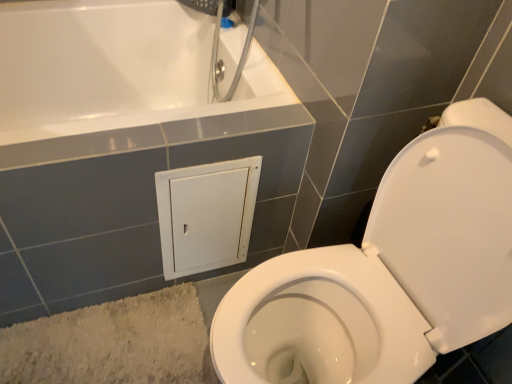
Describe the element at coordinates (113, 343) in the screenshot. The width and height of the screenshot is (512, 384). I see `beige textured bath mat at lower left` at that location.

Measure the distance between beige textured bath mat at lower left and camera.

The distance of beige textured bath mat at lower left from camera is 1.08 meters.

In order to click on beige textured bath mat at lower left in this screenshot , I will do `click(113, 343)`.

Find the location of a particular element. This screenshot has height=384, width=512. white glossy toilet at lower right is located at coordinates (395, 265).

This screenshot has width=512, height=384. Describe the element at coordinates (395, 265) in the screenshot. I see `white glossy toilet at lower right` at that location.

In order to click on beige textured bath mat at lower left in this screenshot , I will do `click(113, 343)`.

From the picture: In the image, is beige textured bath mat at lower left on the left side or the right side of white glossy toilet at lower right?

In the image, beige textured bath mat at lower left appears on the left side of white glossy toilet at lower right.

Consider the image. Which is in front, beige textured bath mat at lower left or white glossy toilet at lower right?

white glossy toilet at lower right is in front.

Considering the points (76, 334) and (475, 234), which point is behind, point (76, 334) or point (475, 234)?

The point (76, 334) is more distant.

From the image's perspective, which one is positioned higher, beige textured bath mat at lower left or white glossy toilet at lower right?

white glossy toilet at lower right, from the image's perspective.

From the picture: From a real-world perspective, between beige textured bath mat at lower left and white glossy toilet at lower right, who is vertically higher?

From a 3D spatial view, white glossy toilet at lower right is above.

Considering the sizes of objects beige textured bath mat at lower left and white glossy toilet at lower right in the image provided, who is thinner, beige textured bath mat at lower left or white glossy toilet at lower right?

beige textured bath mat at lower left.

Consider the image. Considering the sizes of objects beige textured bath mat at lower left and white glossy toilet at lower right in the image provided, who is shorter, beige textured bath mat at lower left or white glossy toilet at lower right?

beige textured bath mat at lower left.

In terms of size, does beige textured bath mat at lower left appear bigger or smaller than white glossy toilet at lower right?

In the image, beige textured bath mat at lower left appears to be smaller than white glossy toilet at lower right.

Is beige textured bath mat at lower left not within white glossy toilet at lower right?

Yes, beige textured bath mat at lower left is outside of white glossy toilet at lower right.

Is beige textured bath mat at lower left far from white glossy toilet at lower right?

No, there isn't a large distance between beige textured bath mat at lower left and white glossy toilet at lower right.

Is beige textured bath mat at lower left oriented away from white glossy toilet at lower right?

No.

How different are the orientations of beige textured bath mat at lower left and white glossy toilet at lower right in degrees?

94.5 degrees.

Locate an element on the screen. Image resolution: width=512 pixels, height=384 pixels. toilet that appears in front of the beige textured bath mat at lower left is located at coordinates coord(395,265).

Is white glossy toilet at lower right to the left or to the right of beige textured bath mat at lower left in the image?

white glossy toilet at lower right is positioned on beige textured bath mat at lower left's right side.

Is white glossy toilet at lower right closer to the viewer compared to beige textured bath mat at lower left?

Yes, the depth of white glossy toilet at lower right is less than that of beige textured bath mat at lower left.

Does point (352, 374) appear closer or farther from the camera than point (79, 337)?

Point (352, 374) is positioned closer to the camera compared to point (79, 337).

From the image's perspective, which object appears higher, white glossy toilet at lower right or beige textured bath mat at lower left?

From the image's view, white glossy toilet at lower right is above.

From a real-world perspective, is white glossy toilet at lower right positioned over beige textured bath mat at lower left based on gravity?

Yes.

Does white glossy toilet at lower right have a greater width compared to beige textured bath mat at lower left?

Yes, white glossy toilet at lower right is wider than beige textured bath mat at lower left.

Who is shorter, white glossy toilet at lower right or beige textured bath mat at lower left?

beige textured bath mat at lower left.

Can you confirm if white glossy toilet at lower right is bigger than beige textured bath mat at lower left?

Yes.

Do you think white glossy toilet at lower right is within beige textured bath mat at lower left, or outside of it?

white glossy toilet at lower right lies outside beige textured bath mat at lower left.

Would you consider white glossy toilet at lower right to be distant from beige textured bath mat at lower left?

They are positioned close to each other.

Is white glossy toilet at lower right oriented away from beige textured bath mat at lower left?

white glossy toilet at lower right does not have its back to beige textured bath mat at lower left.

How different are the orientations of white glossy toilet at lower right and beige textured bath mat at lower left in degrees?

94.5 degrees.

You are a GUI agent. You are given a task and a screenshot of the screen. Output one action in this format:
    pyautogui.click(x=<x>, y=<y>)
    Task: Click on the toilet in front of the beige textured bath mat at lower left
    
    Given the screenshot: What is the action you would take?
    pyautogui.click(x=395, y=265)

This screenshot has height=384, width=512. Identify the location of bath mat on the left of white glossy toilet at lower right. (113, 343).

Locate an element on the screen. bath mat below the white glossy toilet at lower right (from a real-world perspective) is located at coordinates (113, 343).